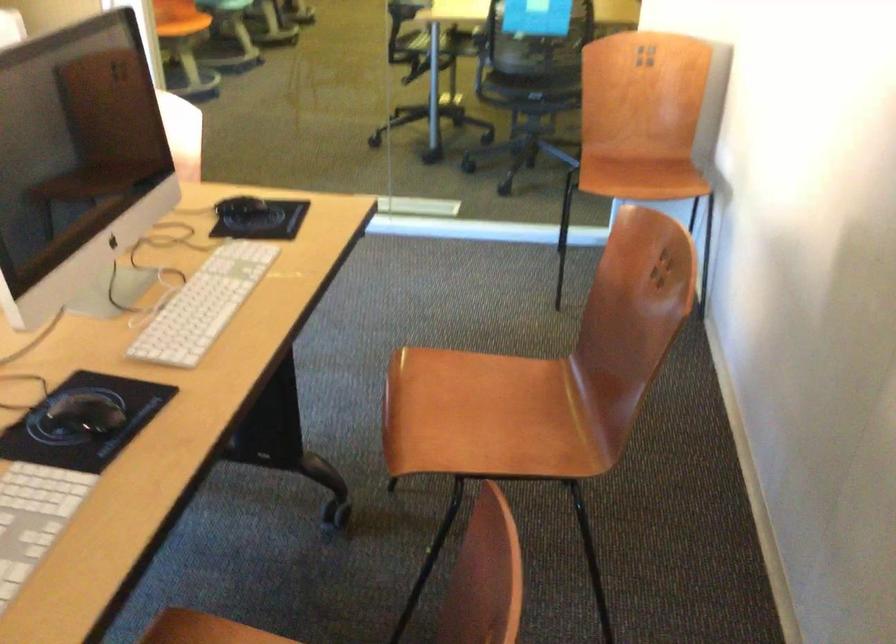
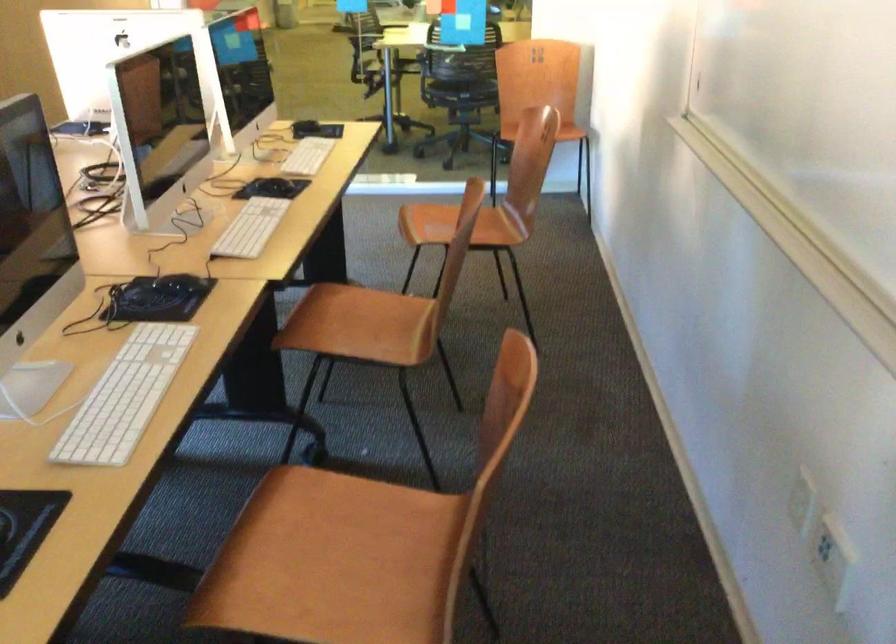
Question: What movement of the cameraman would produce the second image?

Choices:
 (A) Left
 (B) Right
 (C) Forward
 (D) Backward

Answer: (D)